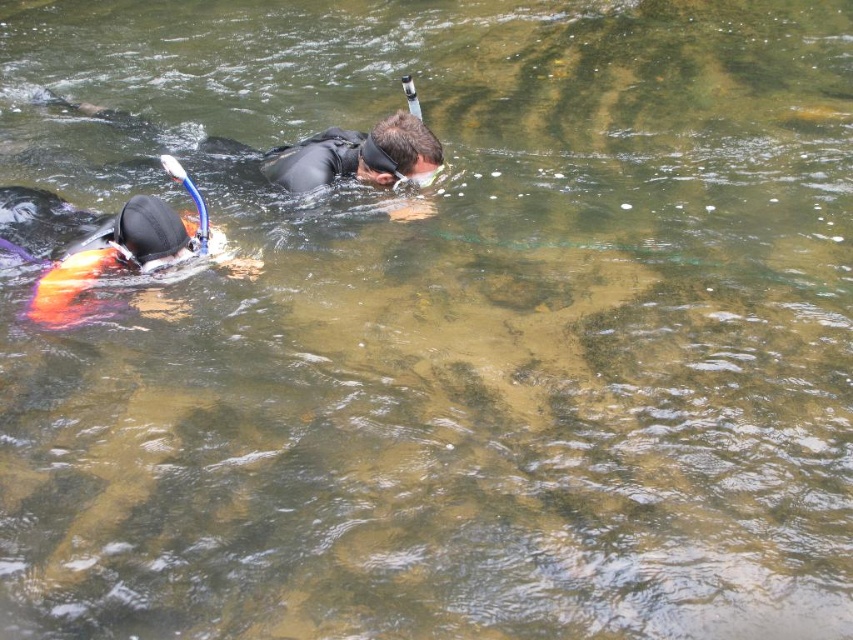
Question: Is black matte wetsuit at center wider than orange life vest at left?

Choices:
 (A) no
 (B) yes

Answer: (B)

Question: Can you confirm if black matte wetsuit at center is bigger than orange life vest at left?

Choices:
 (A) yes
 (B) no

Answer: (A)

Question: Among these objects, which one is farthest from the camera?

Choices:
 (A) orange life vest at left
 (B) black matte wetsuit at center

Answer: (B)

Question: From the image, what is the correct spatial relationship of black matte wetsuit at center in relation to orange life vest at left?

Choices:
 (A) below
 (B) above

Answer: (B)